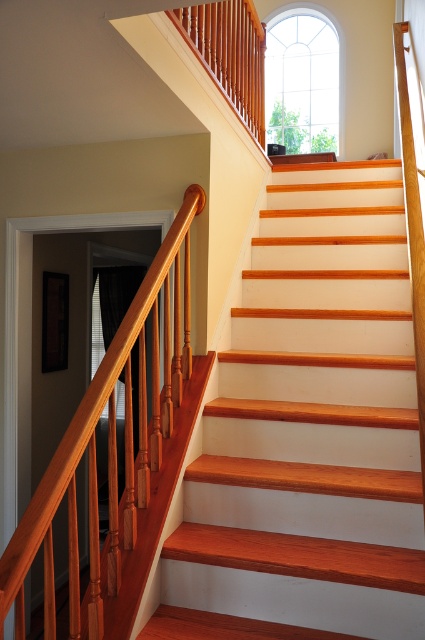
Between polished wood handrail at left and wooden balustrade at upper center, which one has less height?

With less height is wooden balustrade at upper center.

How far apart are polished wood handrail at left and wooden balustrade at upper center?

1.36 meters

Describe the element at coordinates (110, 444) in the screenshot. I see `polished wood handrail at left` at that location.

Locate an element on the screen. This screenshot has width=425, height=640. polished wood handrail at left is located at coordinates (110, 444).

Can you confirm if wooden stair at upper center is shorter than wooden balustrade at upper center?

Yes.

Describe the element at coordinates (308, 432) in the screenshot. I see `wooden stair at upper center` at that location.

Find the location of a particular element. wooden stair at upper center is located at coordinates (308, 432).

Is point (379, 476) farther from camera compared to point (172, 360)?

No.

Is wooden stair at upper center to the left of polished wood handrail at left from the viewer's perspective?

Incorrect, wooden stair at upper center is not on the left side of polished wood handrail at left.

I want to click on wooden stair at upper center, so click(308, 432).

I want to click on wooden stair at upper center, so click(x=308, y=432).